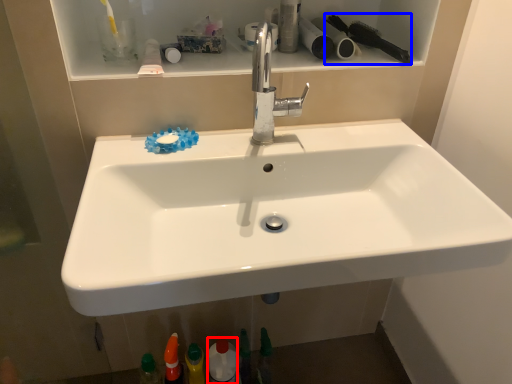
Question: Which object appears closest to the camera in this image, mouthwash (highlighted by a red box) or brush (highlighted by a blue box)?

Choices:
 (A) mouthwash
 (B) brush

Answer: (B)